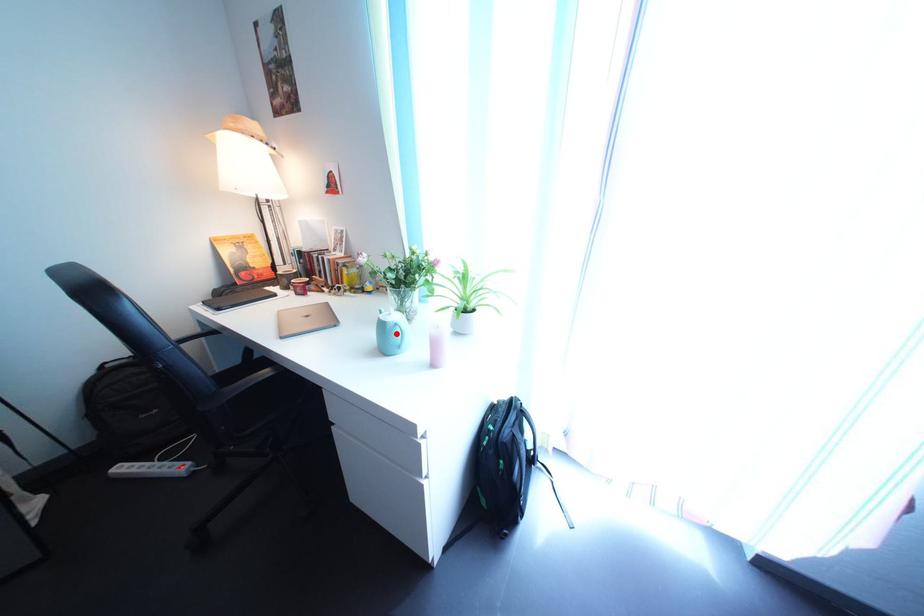
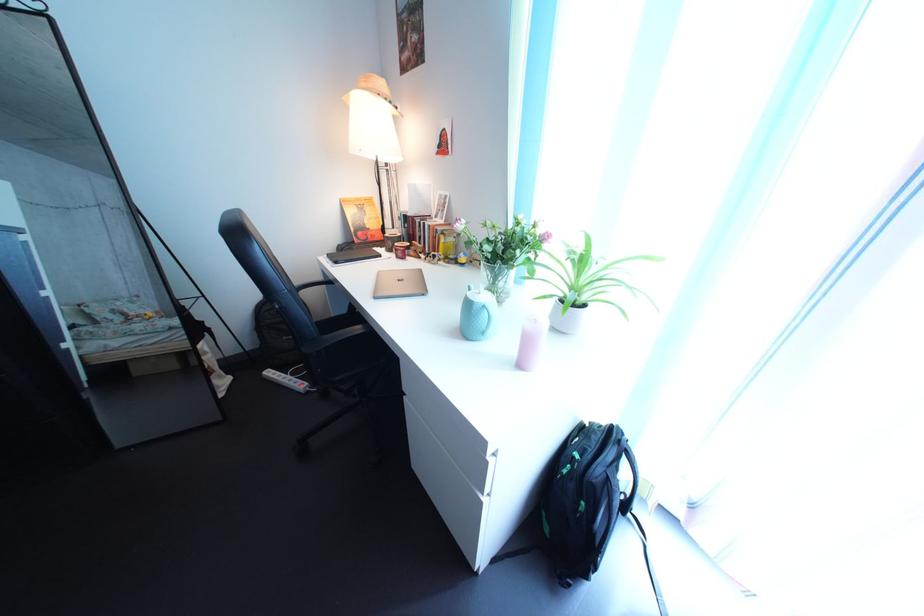
Question: I am providing you with two images of the same scene from different viewpoints. Given a red point in image1, look at the same physical point in image2. Is it:

Choices:
 (A) Closer to the viewpoint
 (B) Farther from the viewpoint

Answer: (B)